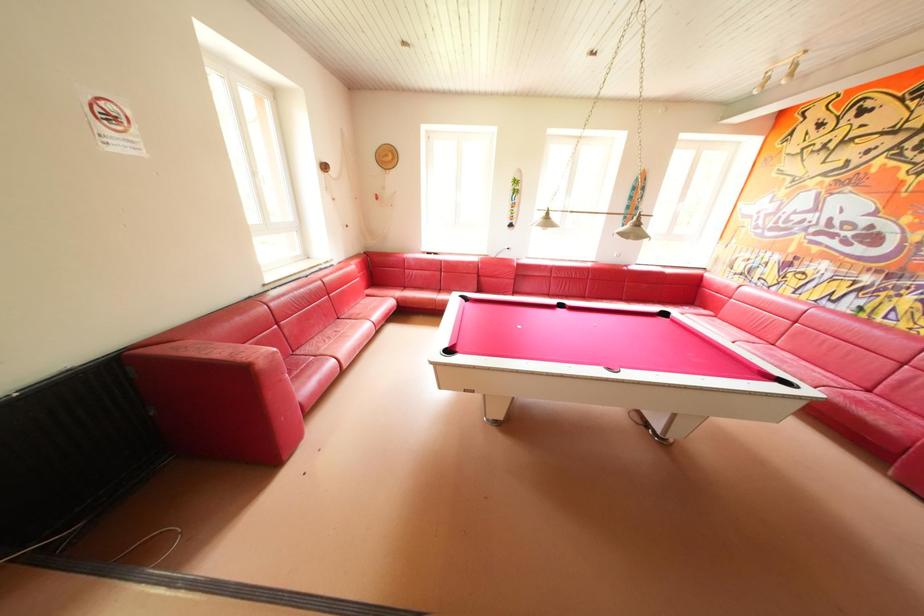
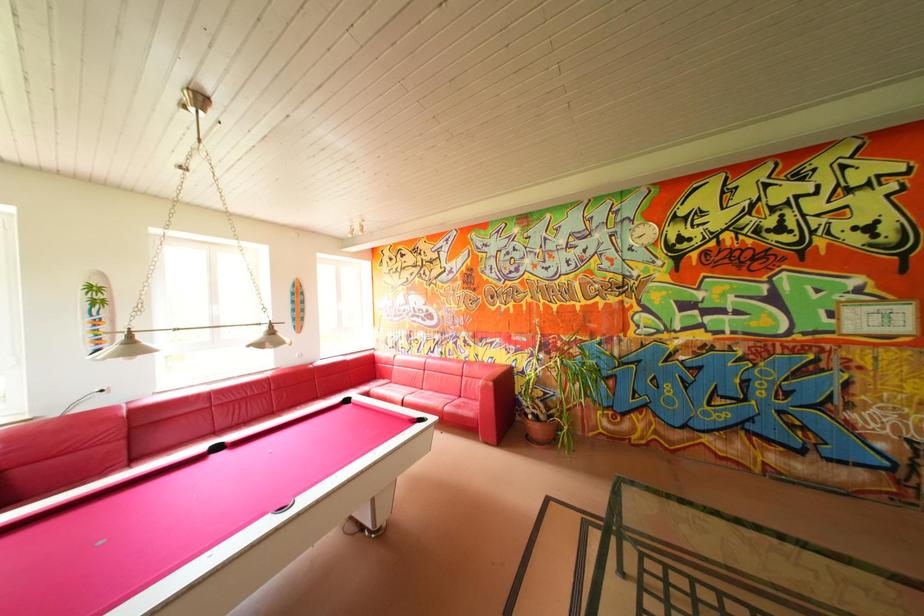
Question: How did the camera likely rotate?

Choices:
 (A) Left
 (B) Right
 (C) Up
 (D) Down

Answer: (B)